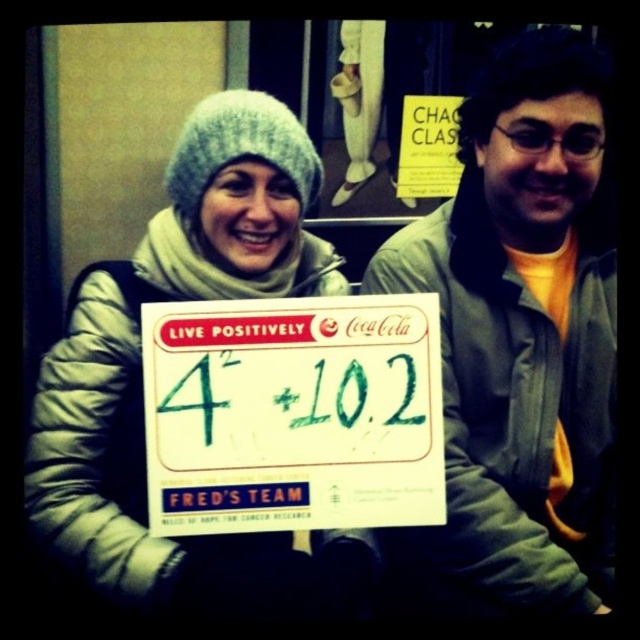
Between white knit hat at upper left and white paper sign at center, which one has more height?

Standing taller between the two is white knit hat at upper left.

Who is shorter, white knit hat at upper left or white paper sign at center?

white paper sign at center is shorter.

Is point (221, 92) farther from viewer compared to point (172, 406)?

Yes, point (221, 92) is farther from viewer.

The image size is (640, 640). I want to click on white knit hat at upper left, so click(x=140, y=380).

Is point (596, 566) positioned after point (116, 356)?

Yes.

Which is behind, point (472, 554) or point (308, 540)?

Point (308, 540)

Does point (616, 253) come behind point (266, 205)?

Yes, point (616, 253) is farther from viewer.

Locate an element on the screen. The height and width of the screenshot is (640, 640). green matte sign at right is located at coordinates (524, 332).

Is green matte sign at right smaller than white paper sign at center?

Incorrect, green matte sign at right is not smaller in size than white paper sign at center.

Image resolution: width=640 pixels, height=640 pixels. What do you see at coordinates (524, 332) in the screenshot?
I see `green matte sign at right` at bounding box center [524, 332].

Identify the location of green matte sign at right. Image resolution: width=640 pixels, height=640 pixels. (524, 332).